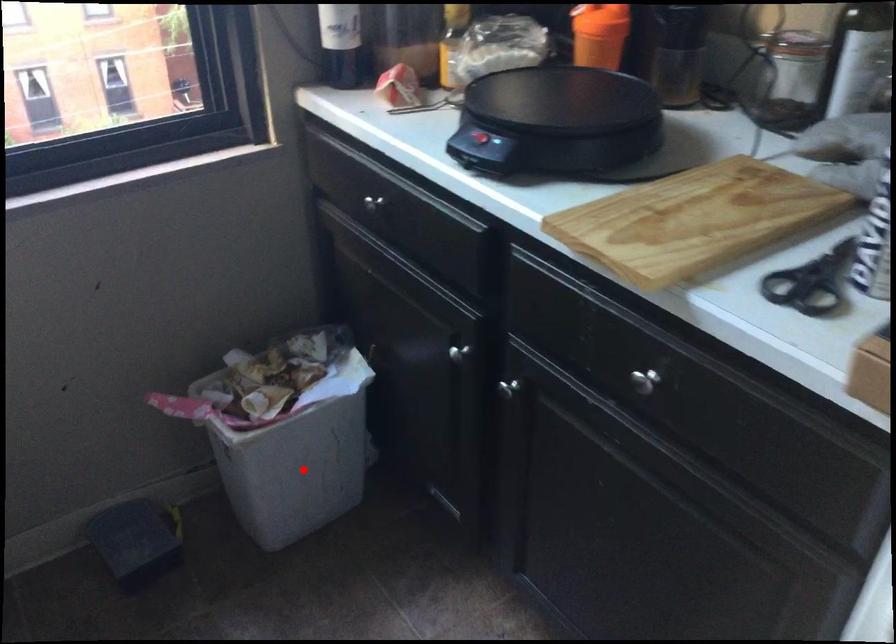
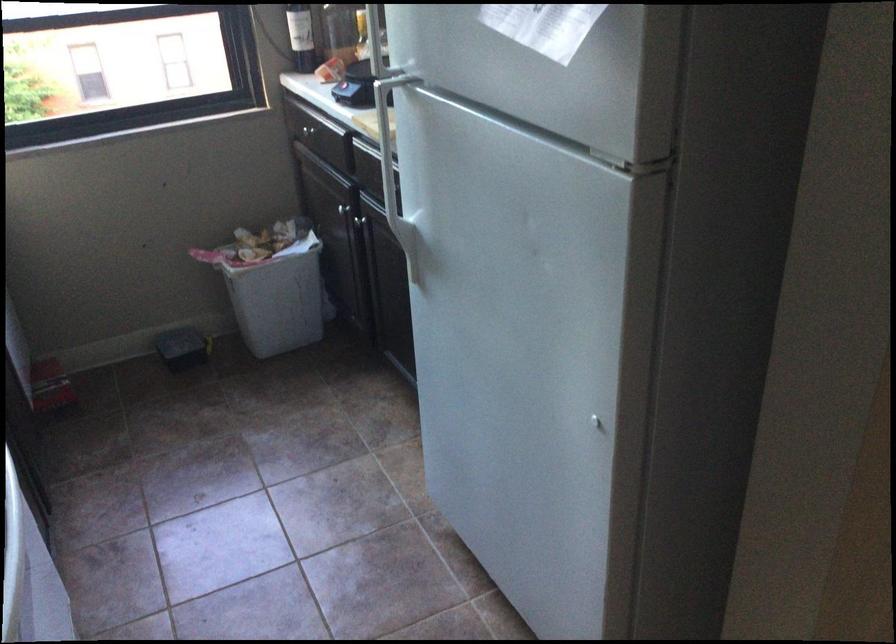
Where in the second image is the point corresponding to the highlighted location from the first image?

(278, 297)